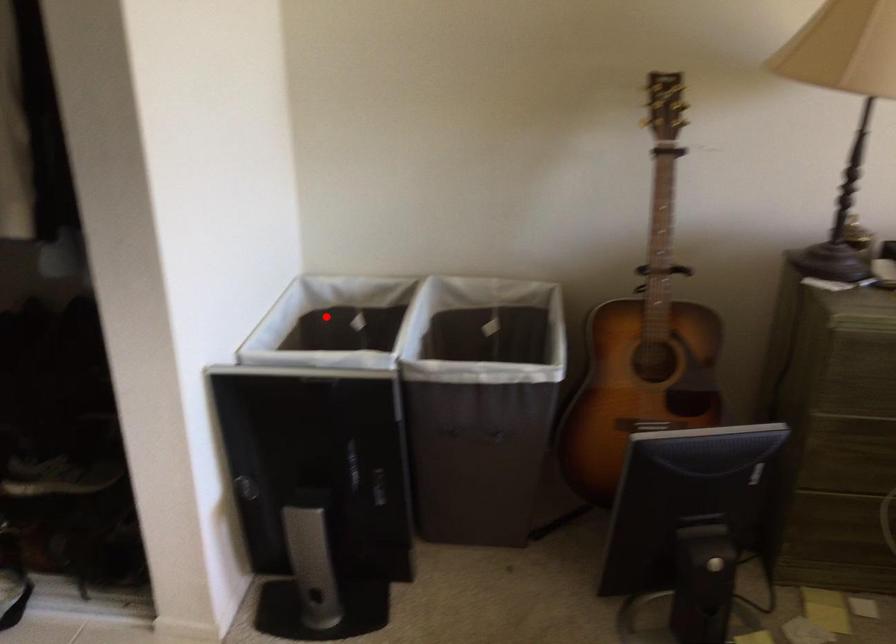
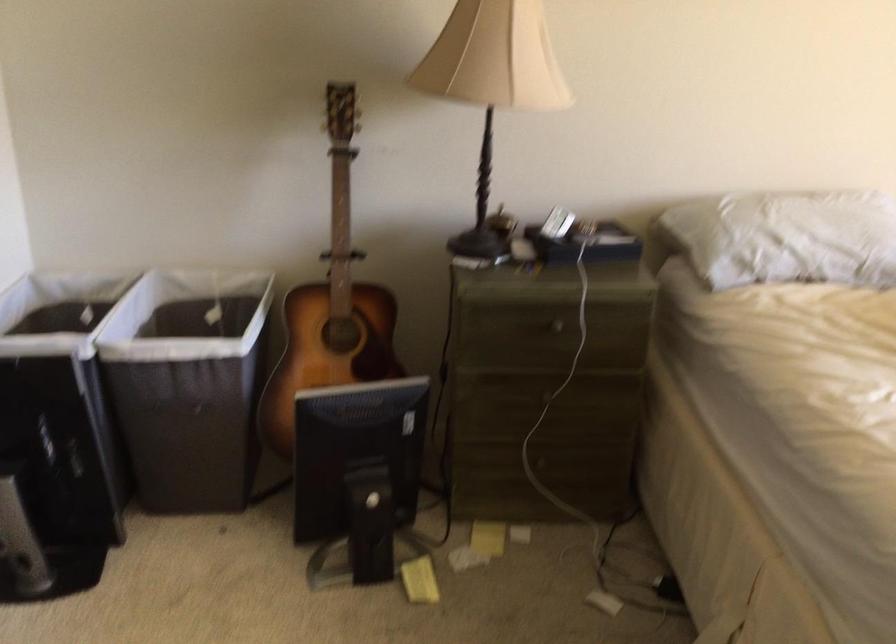
Locate, in the second image, the point that corresponds to the highlighted location in the first image.

(57, 310)